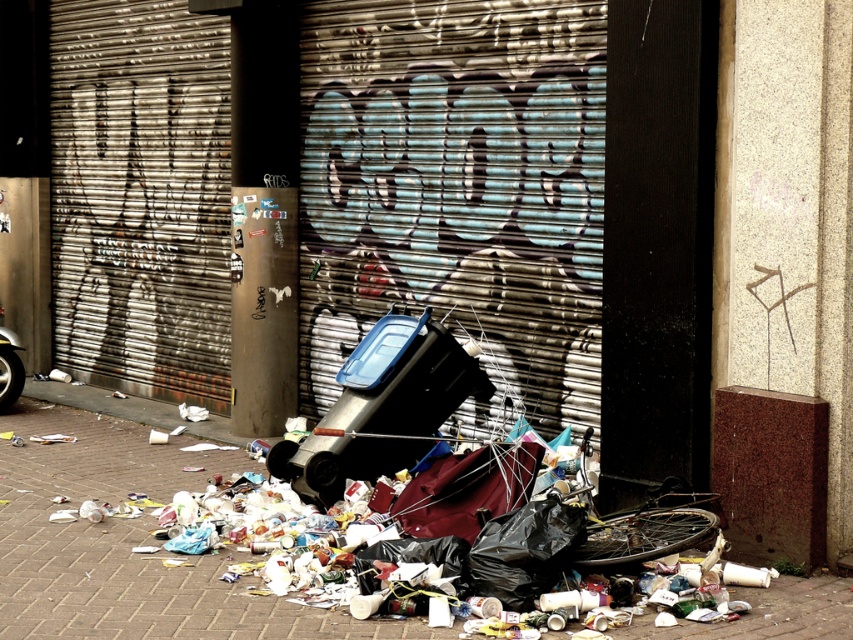
You are a delivery person trying to park your bike between the brushed metal garage door at center and the brick pavement at lower center. Can you fit your bike there if the bike is 1.2 meters wide?

The brushed metal garage door at center might be wider than brick pavement at lower center, but without exact measurements, it is uncertain if the space between them can accommodate a 1.2 meter wide bike. Check the actual distance before parking.

You are a delivery person trying to park your bike. You see the brushed metal garage door at center and the brick pavement at lower center. Which surface would you choose to park your bike on?

You should park your bike on the brick pavement at lower center because the brushed metal garage door at center is a door and not a suitable surface for parking.

You are a painter standing on a ladder in front of the brushed metal garage door at center and the brick pavement at lower center. You want to paint the taller object. Which object should you paint?

The brushed metal garage door at center is taller than the brick pavement at lower center, so you should paint the brushed metal garage door at center.